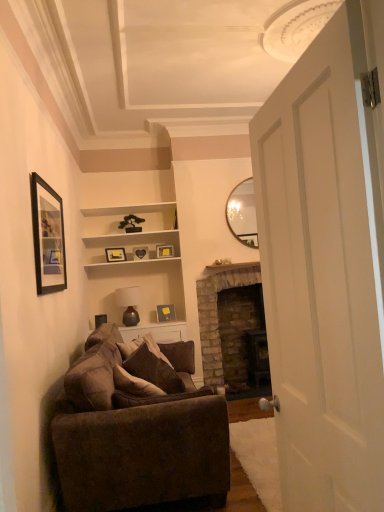
Question: Considering the relative sizes of brick fireplace at center and white matte door at right in the image provided, is brick fireplace at center bigger than white matte door at right?

Choices:
 (A) yes
 (B) no

Answer: (A)

Question: Does brick fireplace at center have a smaller size compared to white matte door at right?

Choices:
 (A) yes
 (B) no

Answer: (B)

Question: Can you confirm if brick fireplace at center is wider than white matte door at right?

Choices:
 (A) no
 (B) yes

Answer: (B)

Question: Is brick fireplace at center beside white matte door at right?

Choices:
 (A) yes
 (B) no

Answer: (B)

Question: Is brick fireplace at center facing towards white matte door at right?

Choices:
 (A) yes
 (B) no

Answer: (A)

Question: Do you think white matte door at right is within brick fireplace at center, or outside of it?

Choices:
 (A) outside
 (B) inside

Answer: (A)

Question: In terms of height, does white matte door at right look taller or shorter compared to brick fireplace at center?

Choices:
 (A) short
 (B) tall

Answer: (B)

Question: In the image, is white matte door at right on the left side or the right side of brick fireplace at center?

Choices:
 (A) left
 (B) right

Answer: (A)

Question: Is point 286,172 positioned closer to the camera than point 223,275?

Choices:
 (A) farther
 (B) closer

Answer: (B)

Question: Considering the positions of matte gold picture frame at center, the 3th picture frame when ordered from top to bottom, and matte gold picture frame at center, which is the second picture frame from top to bottom, in the image, is matte gold picture frame at center, the 3th picture frame when ordered from top to bottom, taller or shorter than matte gold picture frame at center, which is the second picture frame from top to bottom,?

Choices:
 (A) short
 (B) tall

Answer: (B)

Question: Considering the positions of point (137, 245) and point (165, 253), is point (137, 245) closer or farther from the camera than point (165, 253)?

Choices:
 (A) farther
 (B) closer

Answer: (B)

Question: From the image's perspective, relative to matte gold picture frame at center, the 6th picture frame when ordered from front to back, is matte gold picture frame at center, the fourth picture frame from the front, above or below?

Choices:
 (A) below
 (B) above

Answer: (A)

Question: Considering their positions, is matte gold picture frame at center, the fourth picture frame from the front, located in front of or behind matte gold picture frame at center, which is the second picture frame from top to bottom?

Choices:
 (A) front
 (B) behind

Answer: (A)

Question: Is point (117, 256) positioned closer to the camera than point (137, 254)?

Choices:
 (A) farther
 (B) closer

Answer: (B)

Question: Looking at their shapes, would you say matte gold picture frame at center, the fourth picture frame from the back, is wider or thinner than matte gold picture frame at center, the fourth picture frame from the front?

Choices:
 (A) wide
 (B) thin

Answer: (B)